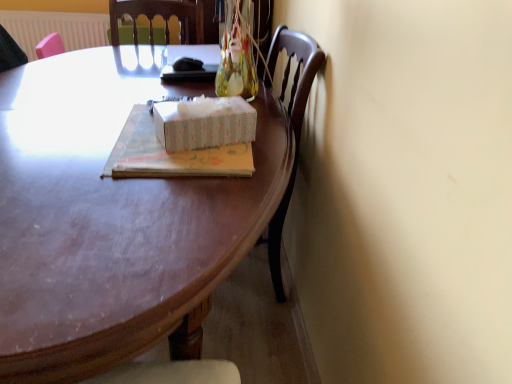
Question: Is there a large distance between matte paper book at center and shiny brown desk at center?

Choices:
 (A) yes
 (B) no

Answer: (B)

Question: Does matte paper book at center come in front of shiny brown desk at center?

Choices:
 (A) no
 (B) yes

Answer: (A)

Question: Would you say matte paper book at center is outside shiny brown desk at center?

Choices:
 (A) yes
 (B) no

Answer: (B)

Question: Considering the relative positions of matte paper book at center and shiny brown desk at center in the image provided, is matte paper book at center to the left of shiny brown desk at center from the viewer's perspective?

Choices:
 (A) yes
 (B) no

Answer: (B)

Question: From the image's perspective, is matte paper book at center on shiny brown desk at center?

Choices:
 (A) no
 (B) yes

Answer: (B)

Question: From the image's perspective, is white paper tissue box at center located above or below shiny brown desk at center?

Choices:
 (A) above
 (B) below

Answer: (A)

Question: Do you think white paper tissue box at center is within shiny brown desk at center, or outside of it?

Choices:
 (A) inside
 (B) outside

Answer: (B)

Question: From their relative heights in the image, would you say white paper tissue box at center is taller or shorter than shiny brown desk at center?

Choices:
 (A) tall
 (B) short

Answer: (B)

Question: Considering the positions of point (232, 137) and point (184, 264), is point (232, 137) closer or farther from the camera than point (184, 264)?

Choices:
 (A) closer
 (B) farther

Answer: (B)

Question: Considering the positions of matte paper book at center and white paper tissue box at center in the image, is matte paper book at center taller or shorter than white paper tissue box at center?

Choices:
 (A) tall
 (B) short

Answer: (B)

Question: Considering the positions of matte paper book at center and white paper tissue box at center in the image, is matte paper book at center bigger or smaller than white paper tissue box at center?

Choices:
 (A) small
 (B) big

Answer: (B)

Question: Choose the correct answer: Is matte paper book at center inside white paper tissue box at center or outside it?

Choices:
 (A) inside
 (B) outside

Answer: (B)

Question: From the image's perspective, is matte paper book at center positioned above or below white paper tissue box at center?

Choices:
 (A) below
 (B) above

Answer: (A)

Question: Considering their positions, is white textured radiator at upper left located in front of or behind white paper tissue box at center?

Choices:
 (A) behind
 (B) front

Answer: (A)

Question: Considering the positions of white textured radiator at upper left and white paper tissue box at center in the image, is white textured radiator at upper left taller or shorter than white paper tissue box at center?

Choices:
 (A) tall
 (B) short

Answer: (A)